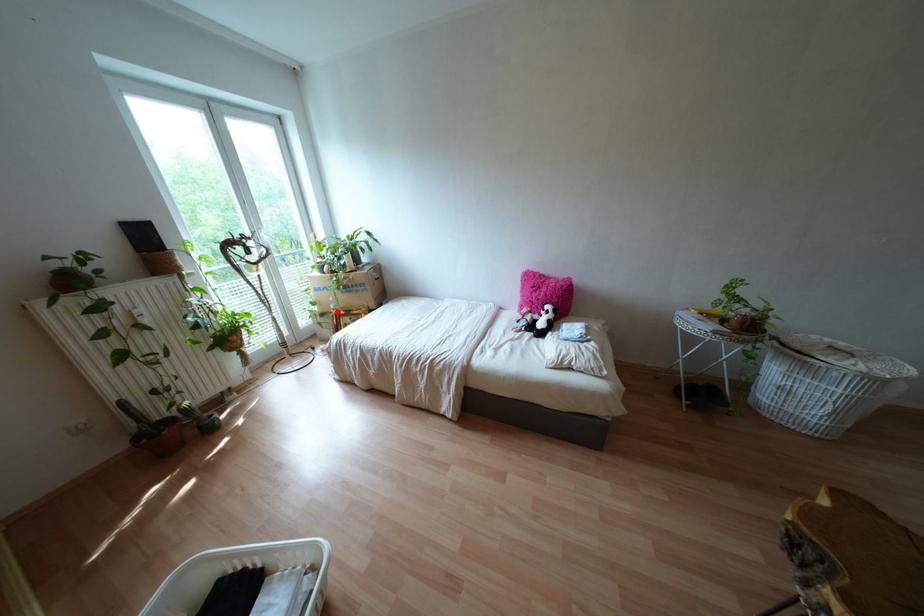
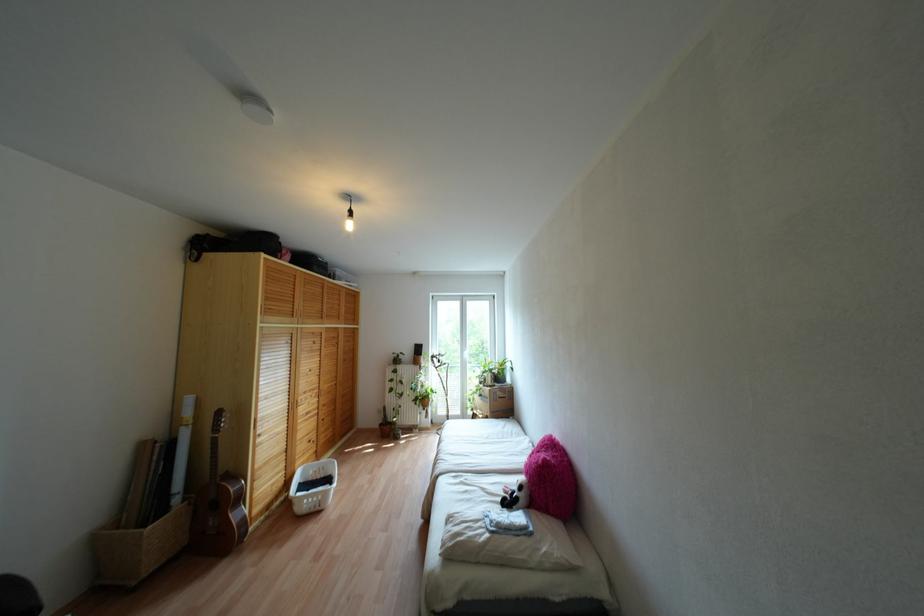
Question: A red point is marked in image1. In image2, is the corresponding 3D point closer to the camera or farther? Reply with the corresponding letter.

Choices:
 (A) The corresponding 3D point is closer.
 (B) The corresponding 3D point is farther.

Answer: (B)